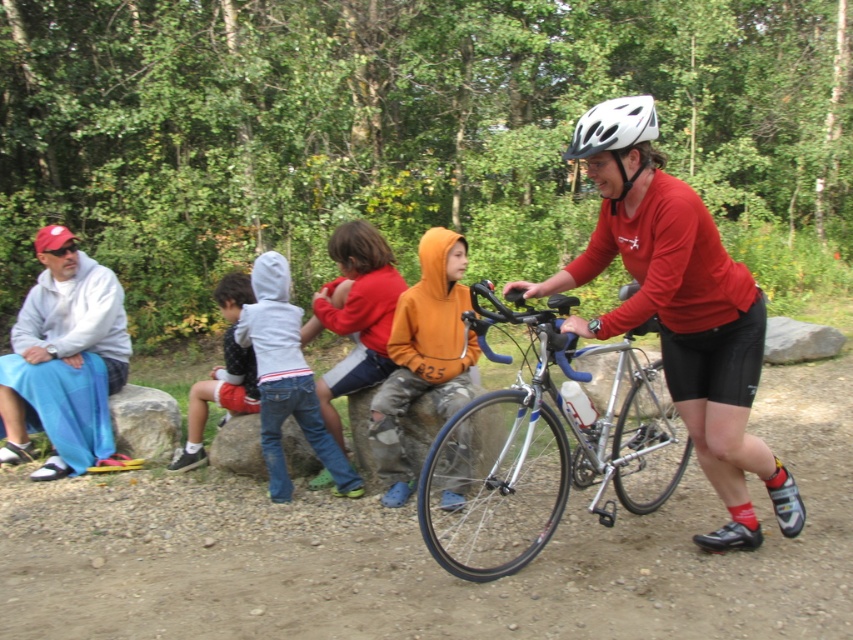
Does dirt track at center have a greater width compared to white matte bicycle helmet at upper center?

Yes, dirt track at center is wider than white matte bicycle helmet at upper center.

Describe the element at coordinates (428, 554) in the screenshot. I see `dirt track at center` at that location.

You are a GUI agent. You are given a task and a screenshot of the screen. Output one action in this format:
    pyautogui.click(x=<x>, y=<y>)
    Task: Click on the dirt track at center
    
    Given the screenshot: What is the action you would take?
    pyautogui.click(x=428, y=554)

Does orange fleece jacket at center have a lesser height compared to white matte bicycle helmet at upper center?

Incorrect, orange fleece jacket at center's height does not fall short of white matte bicycle helmet at upper center's.

Which is behind, point (433, 305) or point (631, 180)?

Positioned behind is point (433, 305).

Image resolution: width=853 pixels, height=640 pixels. Identify the location of orange fleece jacket at center. (424, 355).

Is white cotton hoodie at center shorter than white matte bicycle helmet at upper center?

In fact, white cotton hoodie at center may be taller than white matte bicycle helmet at upper center.

Locate an element on the screen. This screenshot has width=853, height=640. white cotton hoodie at center is located at coordinates (285, 378).

Is point (259, 308) positioned in front of point (648, 134)?

No, it is not.

The height and width of the screenshot is (640, 853). Identify the location of white cotton hoodie at center. (285, 378).